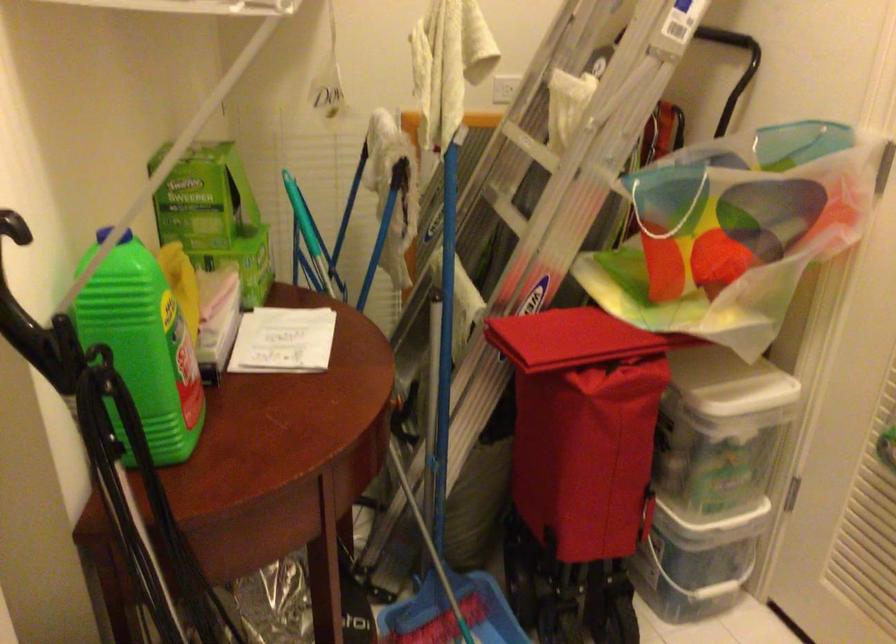
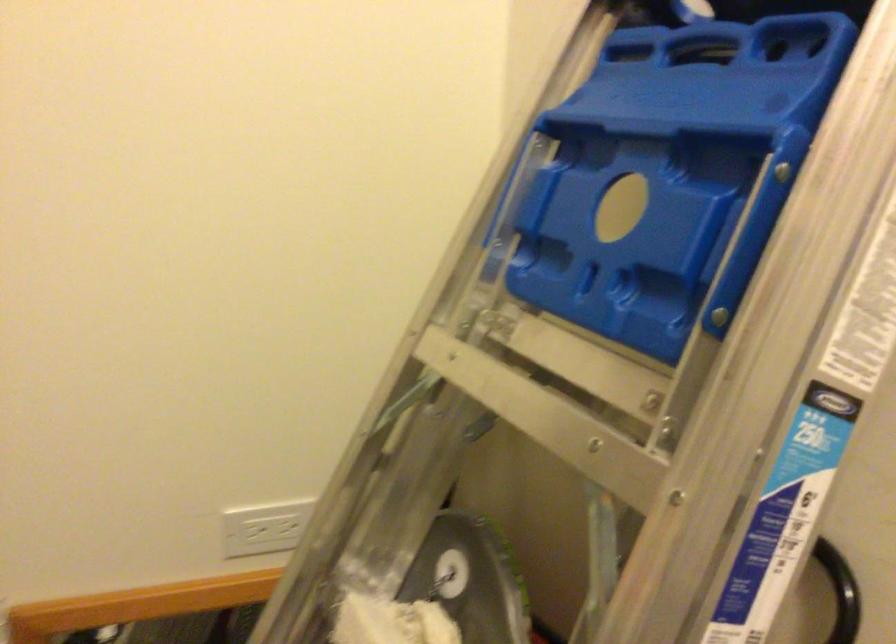
Question: What movement of the cameraman would produce the second image?

Choices:
 (A) Left
 (B) Right
 (C) Forward
 (D) Backward

Answer: (C)